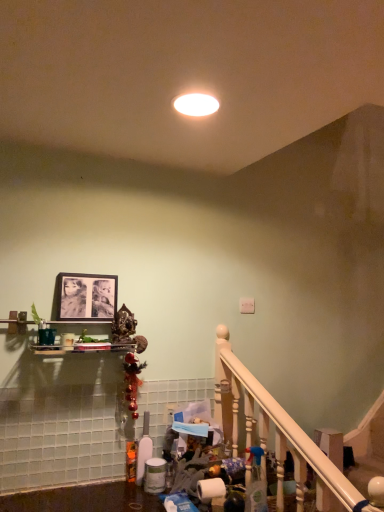
Question: Visually, is white glossy light fixture at center positioned to the left or to the right of white wooden railing at lower right?

Choices:
 (A) right
 (B) left

Answer: (B)

Question: Is point (215, 112) closer or farther from the camera than point (248, 376)?

Choices:
 (A) farther
 (B) closer

Answer: (B)

Question: Estimate the real-world distances between objects in this image. Which object is farther from the clear plastic spray bottle at lower center?

Choices:
 (A) white wooden railing at lower right
 (B) white glossy light fixture at center
 (C) matte black picture frame at upper center

Answer: (B)

Question: Estimate the real-world distances between objects in this image. Which object is farther from the clear plastic spray bottle at lower center?

Choices:
 (A) white glossy light fixture at center
 (B) matte black picture frame at upper center
 (C) white wooden railing at lower right

Answer: (A)